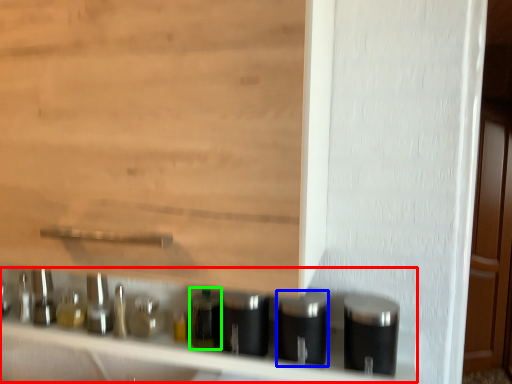
Question: Which object is positioned closest to shelf (highlighted by a red box)? Select from silver (highlighted by a blue box) and bottle (highlighted by a green box).

Choices:
 (A) silver
 (B) bottle

Answer: (B)